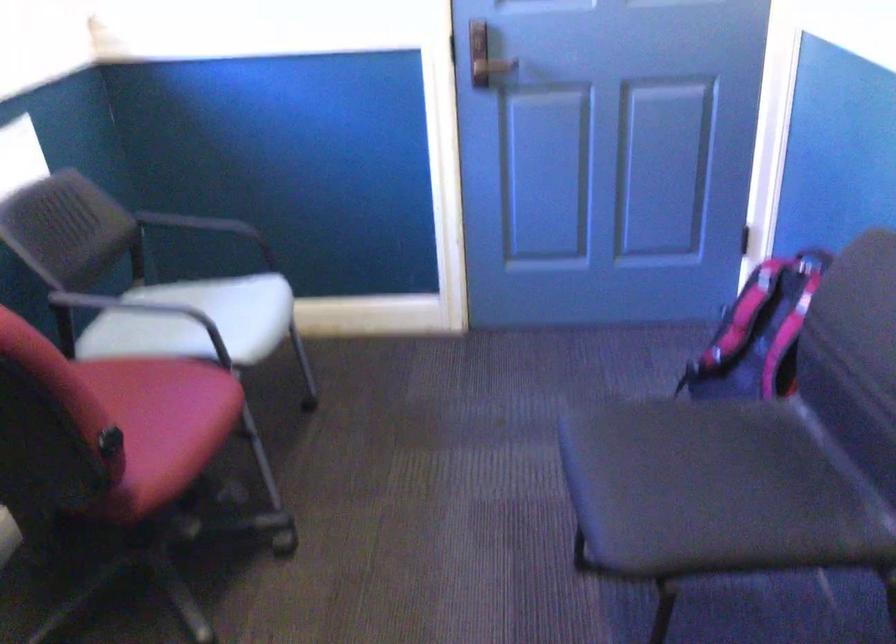
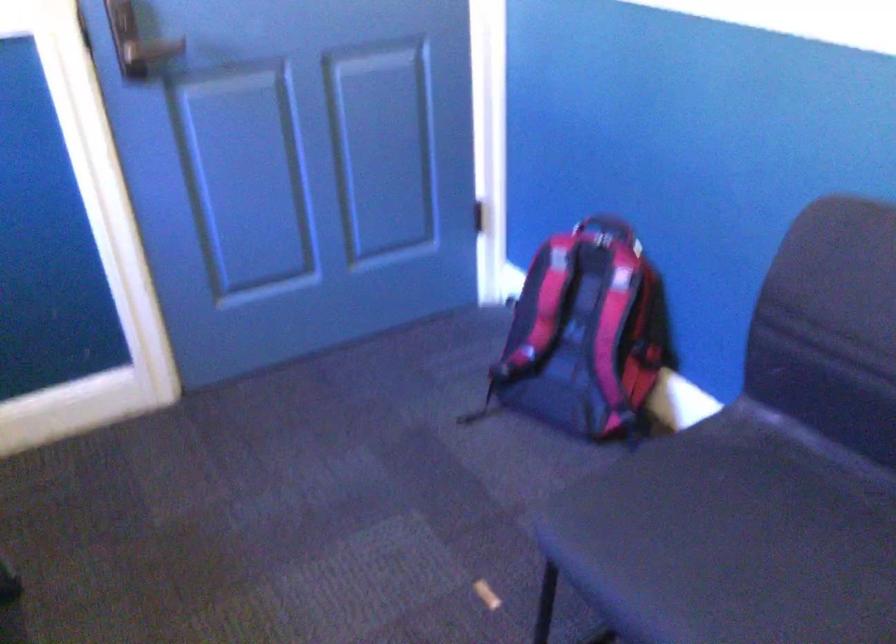
Find the pixel in the second image that matches point 483,73 in the first image.

(152, 50)